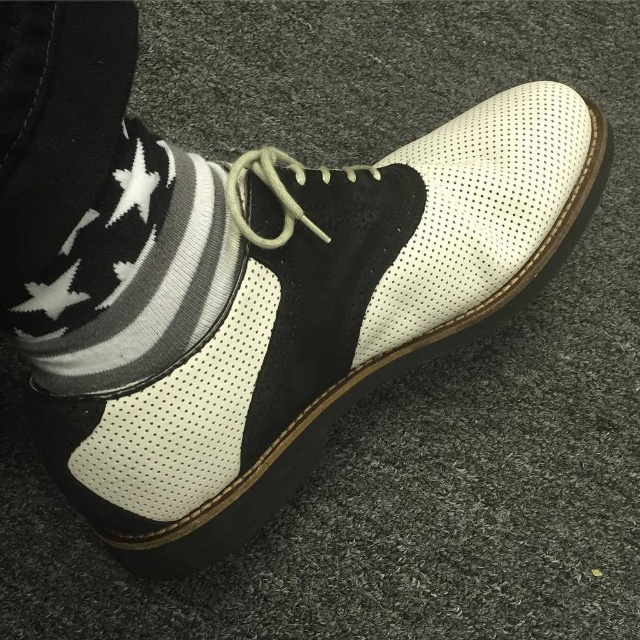
Is white perforated leather shoe at center shorter than white knitted sock at lower left?

No.

Does white perforated leather shoe at center appear over white knitted sock at lower left?

Indeed, white perforated leather shoe at center is positioned over white knitted sock at lower left.

Is point (157, 456) behind point (211, 280)?

Yes, it is behind point (211, 280).

The width and height of the screenshot is (640, 640). What are the coordinates of `white perforated leather shoe at center` in the screenshot? It's located at (324, 321).